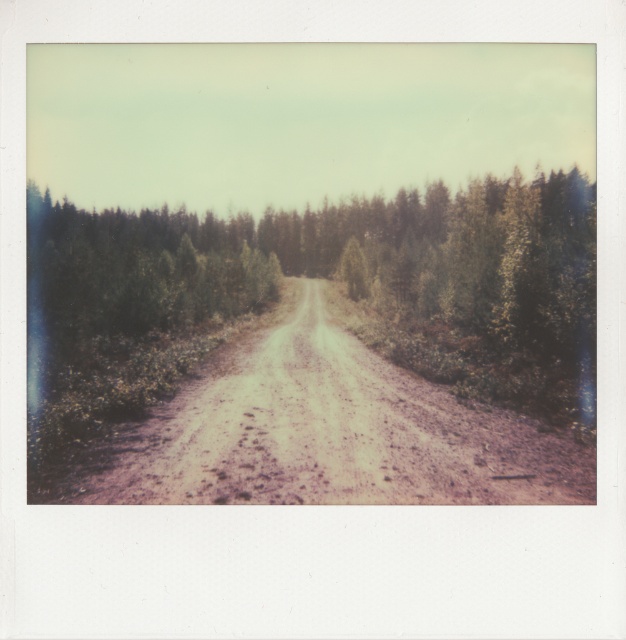
Question: Does green textured forest at center appear on the right side of dusty gravel road at center?

Choices:
 (A) no
 (B) yes

Answer: (A)

Question: Among these points, which one is nearest to the camera?

Choices:
 (A) (439, 486)
 (B) (331, 234)

Answer: (A)

Question: Can you confirm if green textured forest at center is positioned to the right of dusty gravel road at center?

Choices:
 (A) no
 (B) yes

Answer: (A)

Question: Is green textured forest at center below dusty gravel road at center?

Choices:
 (A) no
 (B) yes

Answer: (A)